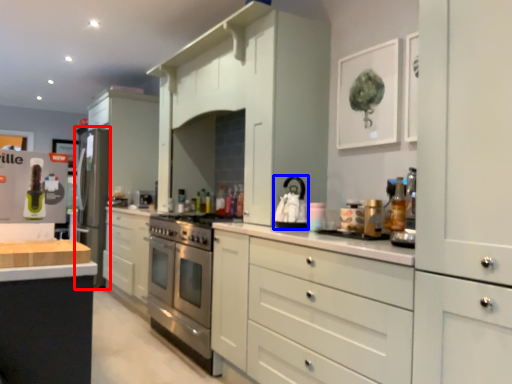
Question: Which object is closer to the camera taking this photo, appliance (highlighted by a red box) or appliance (highlighted by a blue box)?

Choices:
 (A) appliance
 (B) appliance

Answer: (B)